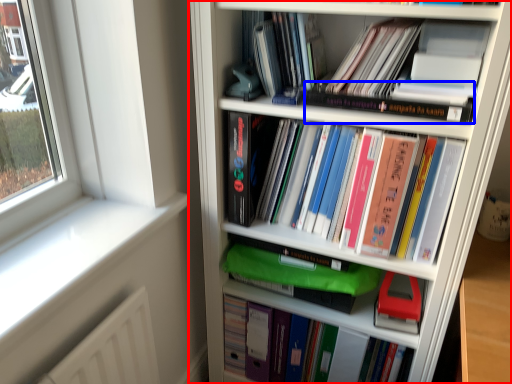
Question: Among these objects, which one is nearest to the camera, bookcase (highlighted by a red box) or book (highlighted by a blue box)?

Choices:
 (A) bookcase
 (B) book

Answer: (A)